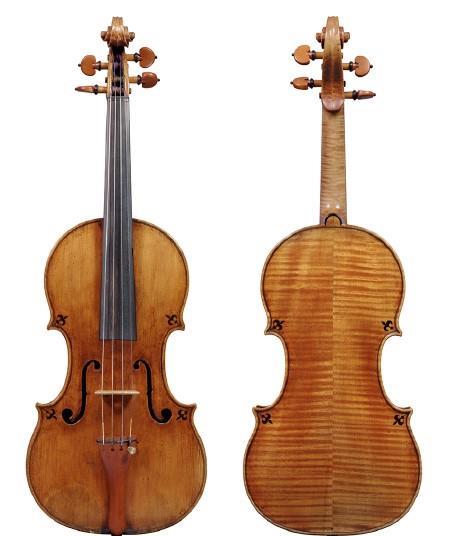
This screenshot has height=536, width=453. In order to click on handle in this screenshot , I will do `click(335, 163)`.